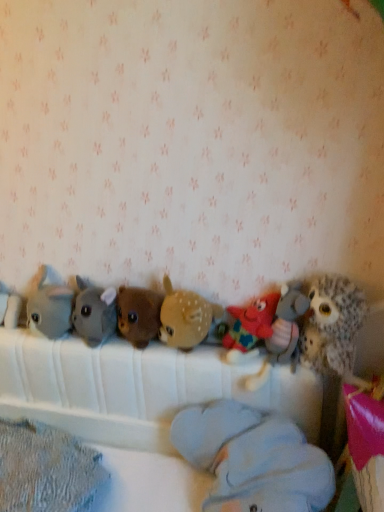
Question: Relative to light blue plush at center, marked as the 6th toy in a left-to-right arrangement, is brown plush bear at center, which appears as the 4th toy when viewed from the left, in front or behind?

Choices:
 (A) behind
 (B) front

Answer: (A)

Question: From a real-world perspective, is brown plush bear at center, which appears as the 4th toy when viewed from the left, above or below light blue plush at center, marked as the 6th toy in a left-to-right arrangement?

Choices:
 (A) below
 (B) above

Answer: (B)

Question: Estimate the real-world distances between objects in this image. Which object is closer to the brown plush bear at center, which appears as the sixth toy when viewed from the right?

Choices:
 (A) brown fuzzy deer at center, marked as the fifth toy in a left-to-right arrangement
 (B) white plush elephant at left, positioned as the 9th toy in right-to-left order
 (C) soft gray plush at center, the third toy in the left-to-right sequence
 (D) gray plush toy at left, acting as the eighth toy starting from the right
 (E) multicolored plush starfish at center, marked as the 8th toy in a left-to-right arrangement

Answer: (C)

Question: Which object is positioned closest to the light blue plush at center, positioned as the fourth toy in right-to-left order?

Choices:
 (A) brown plush bear at center, which appears as the 4th toy when viewed from the left
 (B) white plush elephant at left, which ranks as the first toy in left-to-right order
 (C) gray plush toy at left, acting as the eighth toy starting from the right
 (D) multicolored fabric star at center, arranged as the seventh toy when viewed from the left
 (E) multicolored plush starfish at center, marked as the 8th toy in a left-to-right arrangement

Answer: (E)